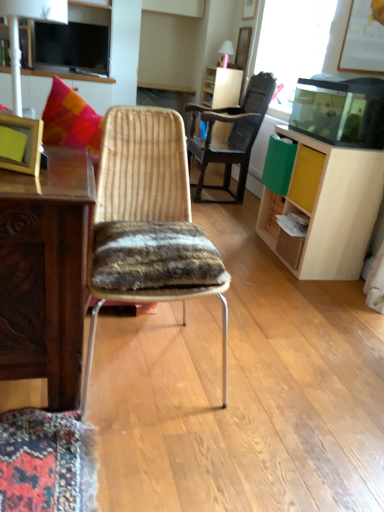
At what (x,y) coordinates should I click in order to perform the action: click on free space to the right of woven wood chair at center, which is the second chair in back-to-front order. Please return your answer as a coordinate pair (x, y). The height and width of the screenshot is (512, 384). Looking at the image, I should click on (279, 380).